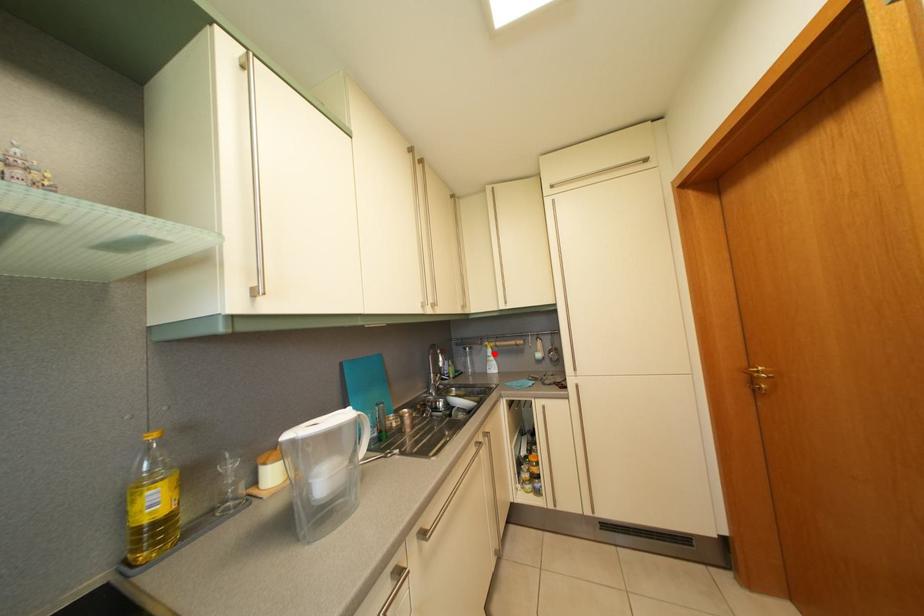
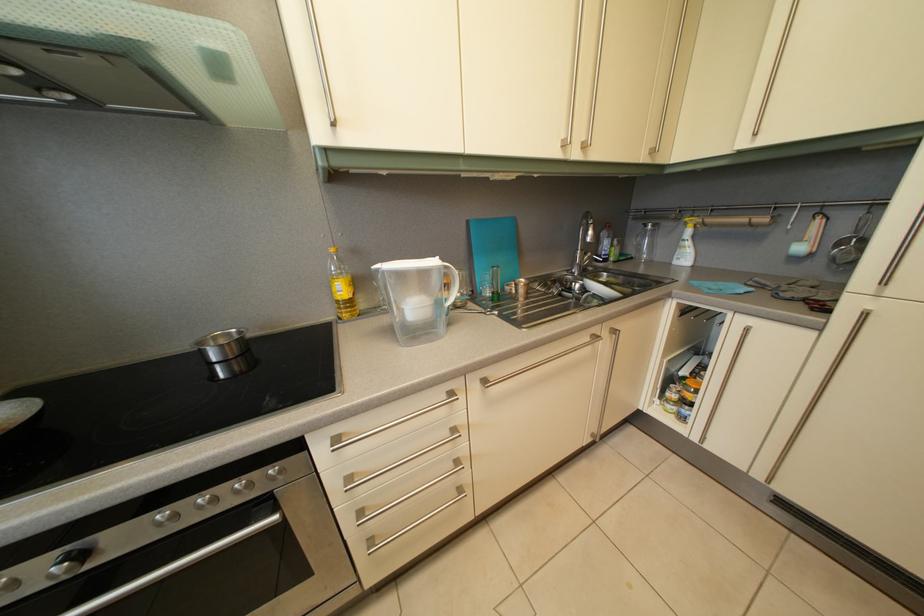
Where in the second image is the point corresponding to the highlighted location from the first image?

(694, 232)